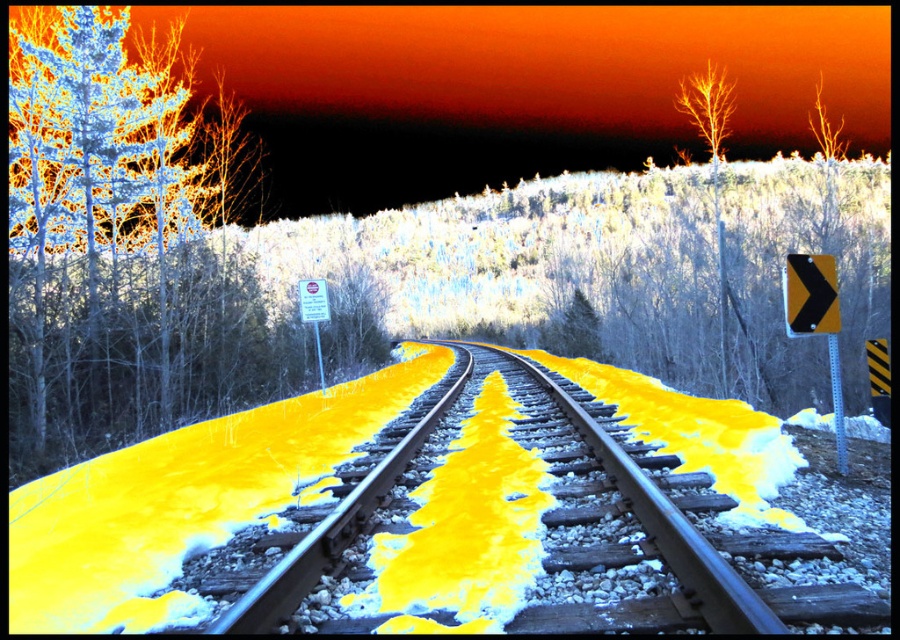
Does white matte tree at upper left have a lesser height compared to wooden railroad tracks at center?

No, white matte tree at upper left is not shorter than wooden railroad tracks at center.

Is the position of white matte tree at upper left less distant than that of wooden railroad tracks at center?

No.

Does point (108, 442) lie in front of point (414, 444)?

No, (108, 442) is further to viewer.

Find the location of a particular element. white matte tree at upper left is located at coordinates (120, 237).

Is white matte tree at upper left thinner than bare wood tree at upper right?

Yes.

Can you confirm if white matte tree at upper left is taller than bare wood tree at upper right?

In fact, white matte tree at upper left may be shorter than bare wood tree at upper right.

Is point (138, 145) positioned after point (706, 102)?

Yes.

This screenshot has width=900, height=640. Identify the location of white matte tree at upper left. (120, 237).

Who is more forward, (740, 588) or (706, 65)?

Positioned in front is point (740, 588).

The image size is (900, 640). I want to click on wooden railroad tracks at center, so click(x=669, y=529).